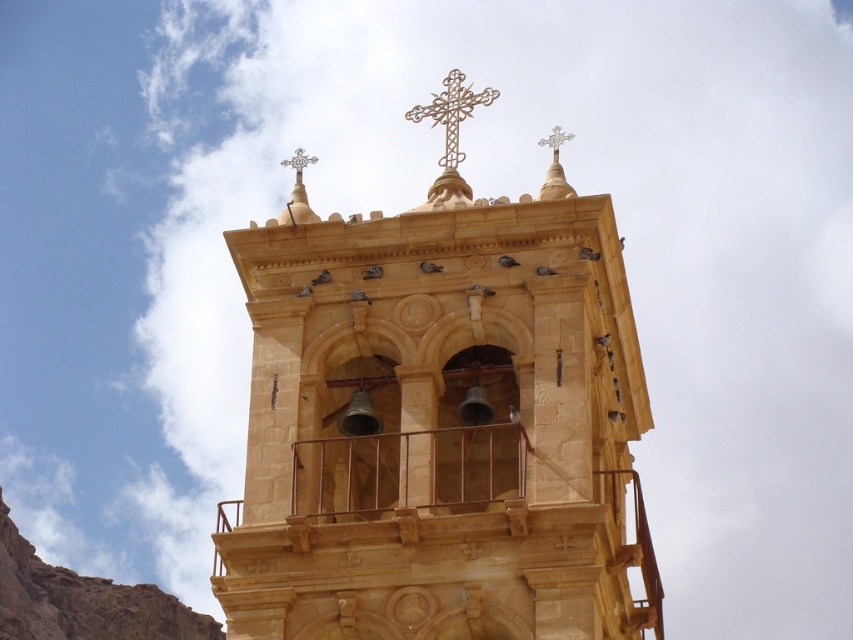
Is point (457, 122) positioned in front of point (297, 160)?

That is False.

Where is `gold textured cross at upper center`? gold textured cross at upper center is located at coordinates (451, 113).

Is metallic cross at upper center closer to camera compared to silver metallic cross at upper center?

No, metallic cross at upper center is further to the viewer.

Can you confirm if metallic cross at upper center is positioned below silver metallic cross at upper center?

Correct, metallic cross at upper center is located below silver metallic cross at upper center.

Where is `metallic cross at upper center`? The height and width of the screenshot is (640, 853). metallic cross at upper center is located at coordinates (299, 163).

Locate an element on the screen. This screenshot has height=640, width=853. metallic cross at upper center is located at coordinates (299, 163).

Is point (520, 312) positioned after point (306, 161)?

That is False.

Between golden stone church at center and metallic cross at upper center, which one appears on the right side from the viewer's perspective?

golden stone church at center is more to the right.

Is point (495, 284) farther from camera compared to point (289, 164)?

That is False.

The height and width of the screenshot is (640, 853). Identify the location of golden stone church at center. (439, 426).